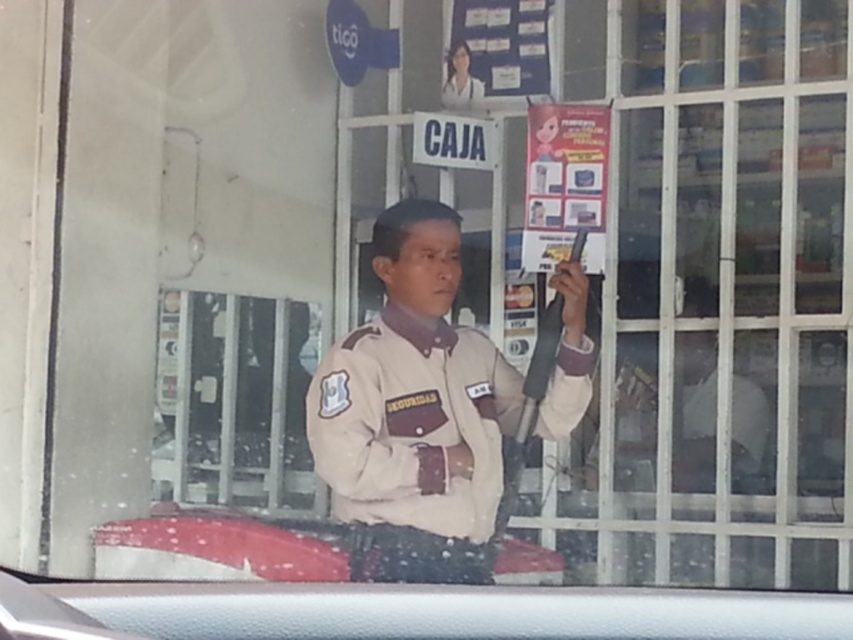
You are a customer trying to locate the security guard in the bank. According to the image, where is the beige fabric uniform at center located?

The beige fabric uniform at center is located at point (413, 424).

You are a customer entering the bank and see the beige fabric uniform at center and the matte paper poster at upper center through the window. Which object is closer to the entrance from your perspective?

The beige fabric uniform at center is closer to the entrance than the matte paper poster at upper center because it is located below it, meaning it is in front of the poster from your viewpoint.